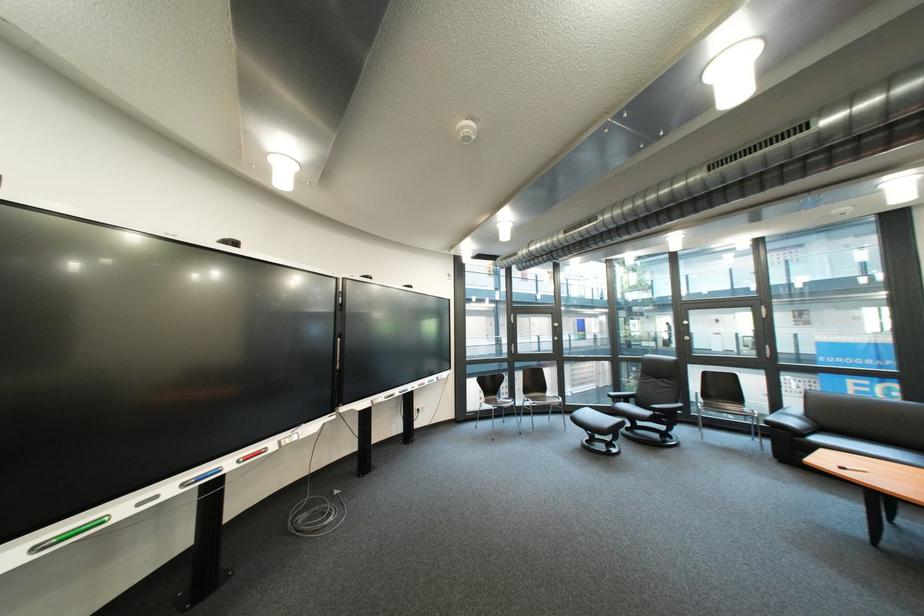
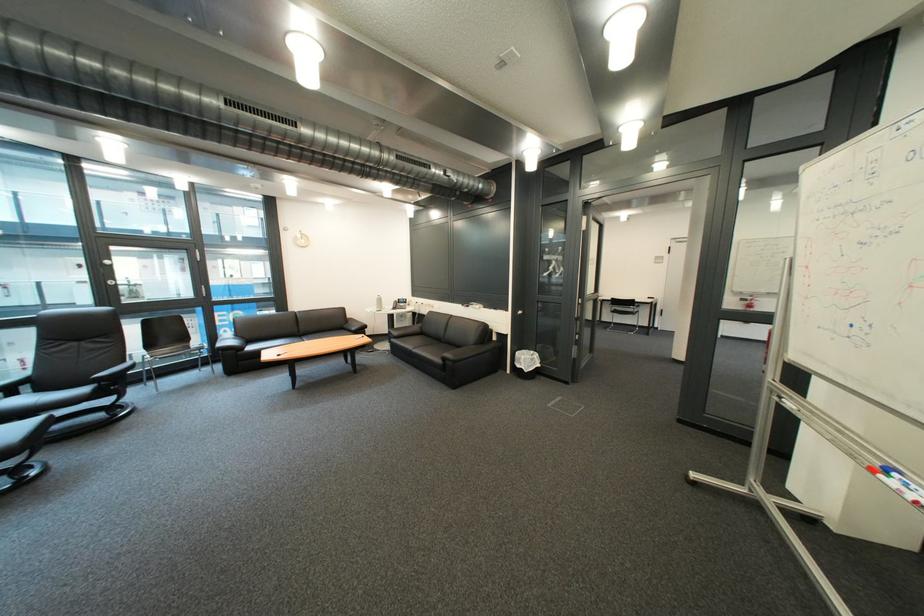
Question: The camera is either moving clockwise (left) or counter-clockwise (right) around the object. The first image is from the beginning of the video and the second image is from the end. Is the camera moving left or right when shooting the video?

Choices:
 (A) Left
 (B) Right

Answer: (A)